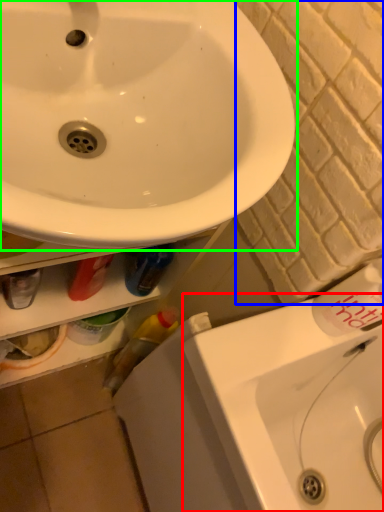
Question: Which object is the closest to the counter top (highlighted by a red box)? Choose among these: brick (highlighted by a blue box) or sink (highlighted by a green box).

Choices:
 (A) brick
 (B) sink

Answer: (A)